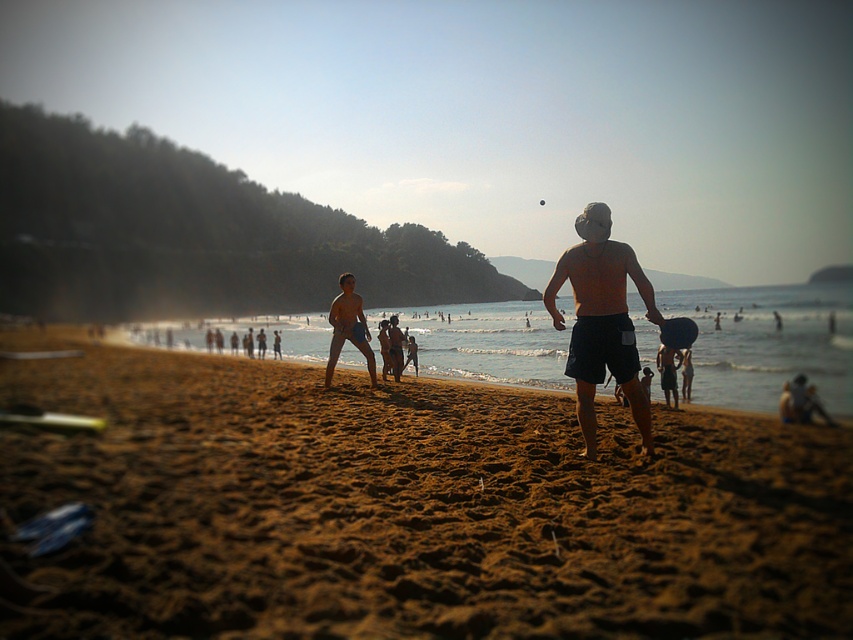
Question: Which object is closer to the camera taking this photo?

Choices:
 (A) orange matte shorts at center
 (B) smooth tan shorts at center
 (C) brown sandy beach at center

Answer: (C)

Question: In this image, where is brown sandy beach at center located relative to orange matte shorts at center?

Choices:
 (A) above
 (B) below

Answer: (B)

Question: Is brown sandy beach at center in front of orange matte shorts at center?

Choices:
 (A) no
 (B) yes

Answer: (B)

Question: Among these points, which one is nearest to the camera?

Choices:
 (A) (332, 355)
 (B) (590, 412)

Answer: (B)

Question: Which object is the farthest from the smooth tan shorts at center?

Choices:
 (A) orange matte shorts at center
 (B) brown sandy beach at center

Answer: (A)

Question: Does orange matte shorts at center have a smaller size compared to smooth tan shorts at center?

Choices:
 (A) yes
 (B) no

Answer: (A)